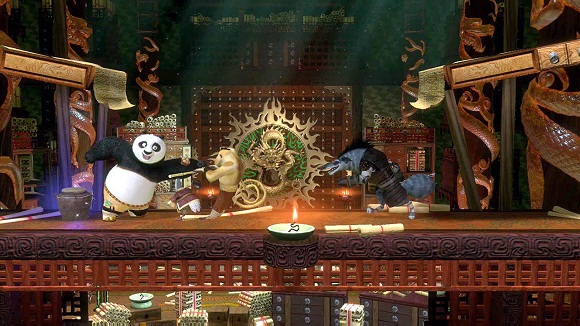
Locate an element on the screen. This screenshot has width=580, height=326. bowl with white interior is located at coordinates (146, 296), (304, 226).